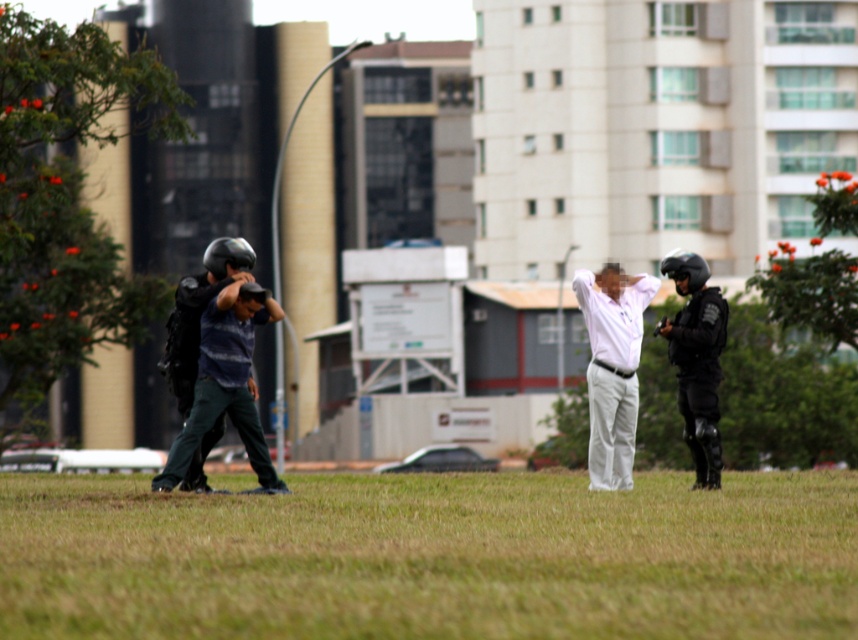
You are a photographer trying to capture a closeup of the white matte shirt at center without including the green grass at center in the frame. Given their relative sizes, is this possible?

The green grass at center is larger than the white matte shirt at center. Since the grass is bigger, it might be challenging to frame the shirt without including some grass, but adjusting the camera angle or zoom could help isolate the shirt if the grass isn

You are an observer at the scene. You see the dark blue striped shirt at center and the black matte helmet at center. Which object is wider?

The dark blue striped shirt at center is wider than the black matte helmet at center.